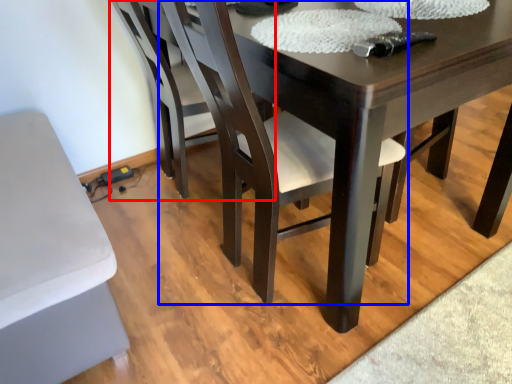
Question: Which object is further to the camera taking this photo, chair (highlighted by a red box) or chair (highlighted by a blue box)?

Choices:
 (A) chair
 (B) chair

Answer: (A)